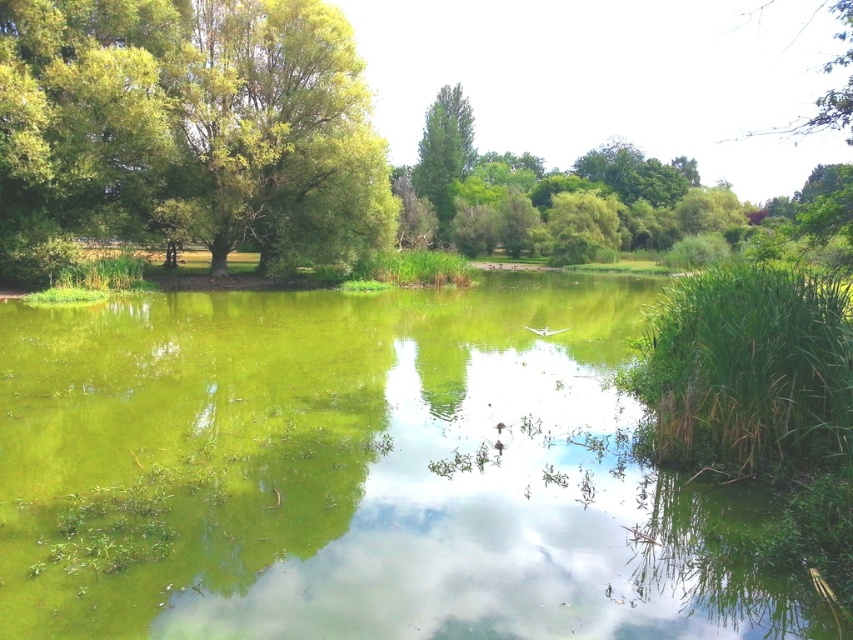
Question: Which object is the farthest from the green algae-covered water at center?

Choices:
 (A) green leafy tree at center
 (B) green leafy tree at left
 (C) green leafy tree at upper right

Answer: (A)

Question: Estimate the real-world distances between objects in this image. Which object is closer to the green algae-covered water at center?

Choices:
 (A) green leafy tree at left
 (B) green leafy tree at upper right
 (C) green leafy tree at center

Answer: (A)

Question: Can you confirm if green algae-covered water at center is wider than green leafy tree at center?

Choices:
 (A) no
 (B) yes

Answer: (B)

Question: In this image, where is green leafy tree at left located relative to green leafy tree at upper right?

Choices:
 (A) right
 (B) left

Answer: (B)

Question: Which object appears closest to the camera in this image?

Choices:
 (A) green algae-covered water at center
 (B) green leafy tree at center

Answer: (A)

Question: Considering the relative positions of green leafy tree at left and green leafy tree at upper right in the image provided, where is green leafy tree at left located with respect to green leafy tree at upper right?

Choices:
 (A) left
 (B) right

Answer: (A)